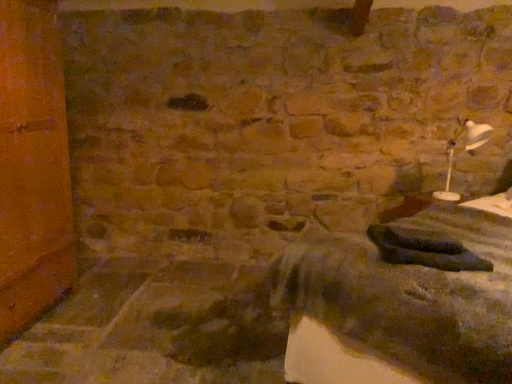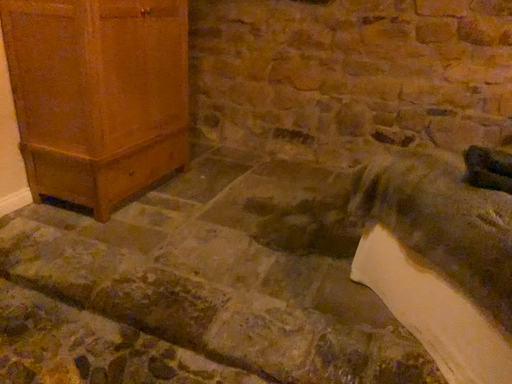
Question: Which way did the camera rotate in the video?

Choices:
 (A) rotated downward
 (B) rotated upward

Answer: (A)